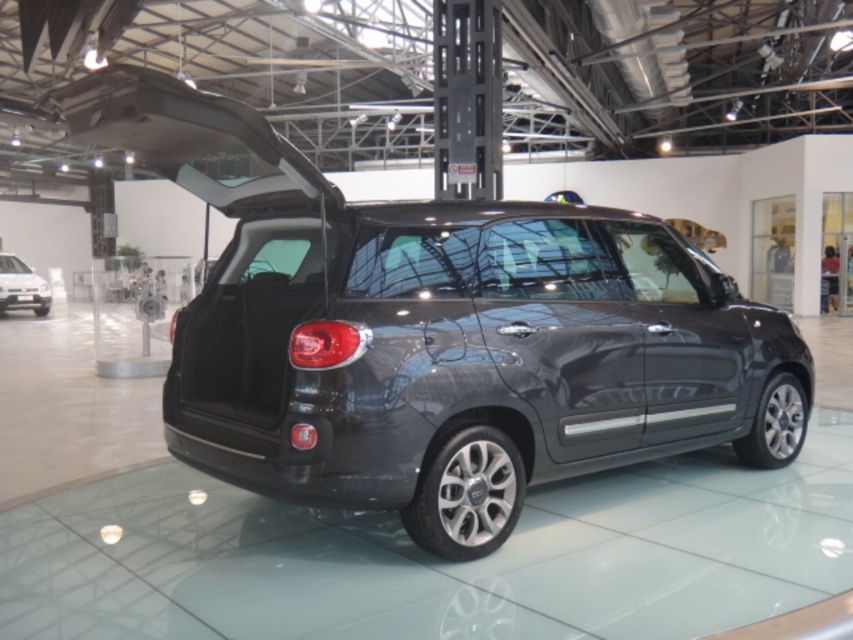
You are standing in a car showroom and notice two points marked on the floor. The first point is at coordinate point (788, 369) and the second is at coordinate point (33, 280). If you want to take a photo of the Fiat 500L parked here, which point should you stand closer to ensure the car is in focus?

You should stand closer to point (788, 369) because it is closer to the camera, allowing the car to be in focus more effectively.

You are standing in a car showroom and see the satin black car at center and the matte black car at lower left. Which car is positioned to the right side of the other?

The satin black car at center is positioned to the right of the matte black car at lower left.

You are a photographer setting up a shoot in the car showroom. You need to position a light source above the satin black car at center so that it doesn not cast a shadow on the matte black car at lower left. Given their heights, can you place the light high enough to achieve this?

The satin black car at center is taller than the matte black car at lower left. To avoid casting a shadow on the matte black car at lower left, the light source should be positioned higher than the height of the satin black car at center.